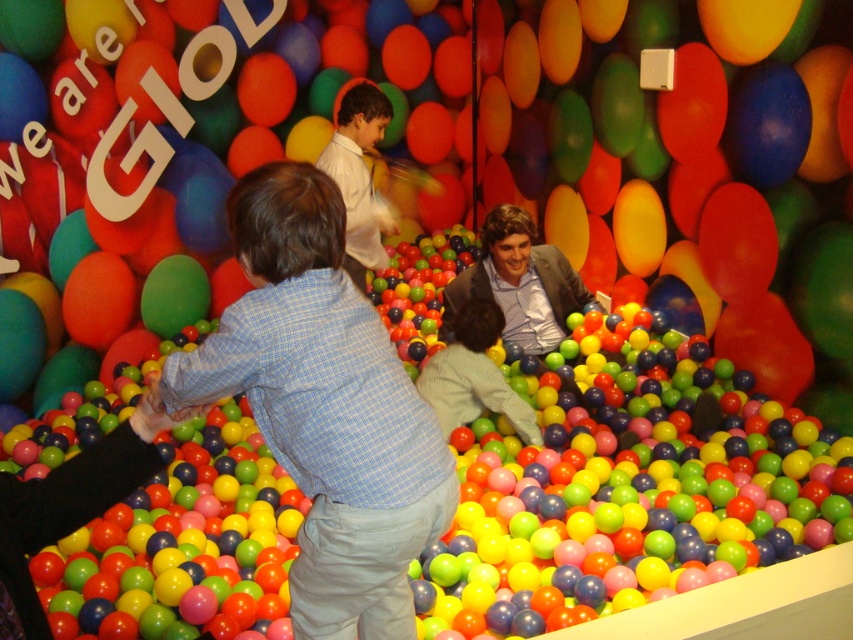
Measure the distance between blue checkered shirt at center and camera.

They are 4.86 feet apart.

Can you confirm if blue checkered shirt at center is shorter than light brown leather jacket at center?

In fact, blue checkered shirt at center may be taller than light brown leather jacket at center.

You are a GUI agent. You are given a task and a screenshot of the screen. Output one action in this format:
    pyautogui.click(x=<x>, y=<y>)
    Task: Click on the blue checkered shirt at center
    Image resolution: width=853 pixels, height=640 pixels.
    Given the screenshot: What is the action you would take?
    pyautogui.click(x=323, y=406)

At what (x,y) coordinates should I click in order to perform the action: click on blue checkered shirt at center. Please return your answer as a coordinate pair (x, y). The width and height of the screenshot is (853, 640). Looking at the image, I should click on (323, 406).

The height and width of the screenshot is (640, 853). What do you see at coordinates (323, 406) in the screenshot?
I see `blue checkered shirt at center` at bounding box center [323, 406].

From the picture: Does blue checkered shirt at center have a lesser width compared to white glossy shirt at center?

Incorrect, blue checkered shirt at center's width is not less than white glossy shirt at center's.

Is point (392, 380) in front of point (376, 86)?

That is True.

At what (x,y) coordinates should I click in order to perform the action: click on blue checkered shirt at center. Please return your answer as a coordinate pair (x, y). Image resolution: width=853 pixels, height=640 pixels. Looking at the image, I should click on 323,406.

Is light green fabric shirt at center to the left of white glossy shirt at center from the viewer's perspective?

In fact, light green fabric shirt at center is to the right of white glossy shirt at center.

Which is in front, point (456, 422) or point (351, 230)?

Point (456, 422)

Find the location of a particular element. The width and height of the screenshot is (853, 640). light green fabric shirt at center is located at coordinates (473, 376).